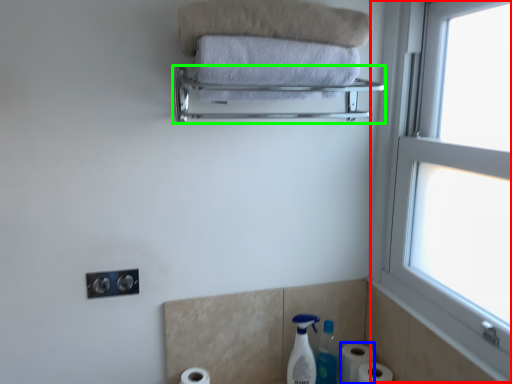
Question: Estimate the real-world distances between objects in this image. Which object is farther from window (highlighted by a red box), toilet paper (highlighted by a blue box) or balustrade (highlighted by a green box)?

Choices:
 (A) toilet paper
 (B) balustrade

Answer: (A)